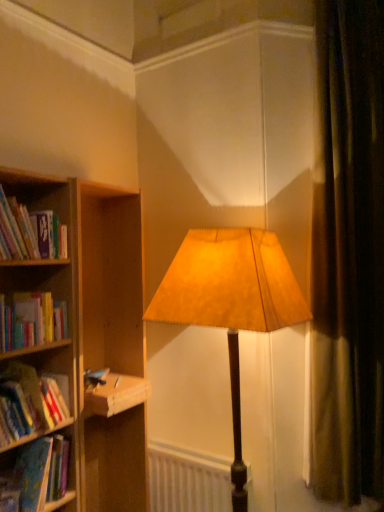
Image resolution: width=384 pixels, height=512 pixels. What do you see at coordinates (231, 303) in the screenshot? I see `suede-like beige lampshade at center` at bounding box center [231, 303].

In order to face hardcover book at left, the 4th book from the bottom, should I rotate leftwards or rightwards?

A 22.271 degree turn to the left will do.

The width and height of the screenshot is (384, 512). What do you see at coordinates (115, 395) in the screenshot? I see `hardcover book at left` at bounding box center [115, 395].

The image size is (384, 512). What do you see at coordinates (31, 321) in the screenshot? I see `hardcover book at left, which is the 2th book from top to bottom` at bounding box center [31, 321].

Measure the distance between hardcover book at left, the 1th book positioned from the bottom, and camera.

A distance of 4.94 feet exists between hardcover book at left, the 1th book positioned from the bottom, and camera.

Identify the location of suede-like beige lampshade at center. Image resolution: width=384 pixels, height=512 pixels. (231, 303).

Based on the photo, which is more to the right, suede-like beige lampshade at center or hardcover book at left, arranged as the fourth book when viewed from the top?

suede-like beige lampshade at center.

Is hardcover book at left, the 1th book positioned from the bottom, at the back of suede-like beige lampshade at center?

No, suede-like beige lampshade at center's orientation is not away from hardcover book at left, the 1th book positioned from the bottom.

This screenshot has height=512, width=384. Find the location of `lamp above the hardcover book at left, arranged as the fourth book when viewed from the top (from a real-world perspective)`. lamp above the hardcover book at left, arranged as the fourth book when viewed from the top (from a real-world perspective) is located at coordinates (231, 303).

Is suede-like beige lampshade at center in front of or behind hardcover book at left, the 1th book positioned from the bottom, in the image?

suede-like beige lampshade at center is behind hardcover book at left, the 1th book positioned from the bottom.

In the scene shown: In the image, is suede-like beige lampshade at center positioned in front of or behind hardcover book at left, which ranks as the 1th book in top-to-bottom order?

Visually, suede-like beige lampshade at center is located behind hardcover book at left, which ranks as the 1th book in top-to-bottom order.

From the picture: From the image's perspective, is suede-like beige lampshade at center under hardcover book at left, the 4th book from the bottom?

Yes.

Between suede-like beige lampshade at center and hardcover book at left, the 4th book from the bottom, which one appears on the left side from the viewer's perspective?

hardcover book at left, the 4th book from the bottom.

Considering the sizes of suede-like beige lampshade at center and hardcover book at left, the 4th book from the bottom, in the image, is suede-like beige lampshade at center taller or shorter than hardcover book at left, the 4th book from the bottom,?

suede-like beige lampshade at center is taller than hardcover book at left, the 4th book from the bottom.

Which object is closer to the camera taking this photo, brown velvet curtain at right or hardcover book at left, the 4th book from the bottom?

hardcover book at left, the 4th book from the bottom, is in front.

Is brown velvet curtain at right not within hardcover book at left, which ranks as the 1th book in top-to-bottom order?

Yes, brown velvet curtain at right is outside of hardcover book at left, which ranks as the 1th book in top-to-bottom order.

Which object is positioned more to the right, brown velvet curtain at right or hardcover book at left, which ranks as the 1th book in top-to-bottom order?

From the viewer's perspective, brown velvet curtain at right appears more on the right side.

Is the surface of hardcover book at left, arranged as the fourth book when viewed from the top, in direct contact with white matte radiator at lower center?

No, hardcover book at left, arranged as the fourth book when viewed from the top, is not beside white matte radiator at lower center.

Identify the location of the 1st book counting from the left of the white matte radiator at lower center. The width and height of the screenshot is (384, 512). (37, 475).

Could you measure the distance between hardcover book at left, the 1th book positioned from the bottom, and white matte radiator at lower center?

hardcover book at left, the 1th book positioned from the bottom, is 30.59 inches away from white matte radiator at lower center.

Who is shorter, hardcover book at left, arranged as the fourth book when viewed from the top, or white matte radiator at lower center?

hardcover book at left, arranged as the fourth book when viewed from the top, is shorter.

From the image's perspective, is hardcover book at left, which is the 2th book from top to bottom, above or below white matte radiator at lower center?

hardcover book at left, which is the 2th book from top to bottom, is above white matte radiator at lower center.

Who is taller, hardcover book at left, which is the 2th book from top to bottom, or white matte radiator at lower center?

white matte radiator at lower center.

Considering the sizes of hardcover book at left, the 3th book positioned from the bottom, and white matte radiator at lower center in the image, is hardcover book at left, the 3th book positioned from the bottom, bigger or smaller than white matte radiator at lower center?

hardcover book at left, the 3th book positioned from the bottom, is smaller than white matte radiator at lower center.

Is brown velvet curtain at right inside or outside of white matte radiator at lower center?

brown velvet curtain at right is located beyond the bounds of white matte radiator at lower center.

How distant is brown velvet curtain at right from white matte radiator at lower center?

They are 32.74 inches apart.

Which of these two, brown velvet curtain at right or white matte radiator at lower center, is wider?

brown velvet curtain at right is wider.

From a real-world perspective, relative to white matte radiator at lower center, is brown velvet curtain at right vertically above or below?

brown velvet curtain at right is above white matte radiator at lower center.

In terms of size, does hardcover book at left, which is the 2th book from top to bottom, appear bigger or smaller than suede-like beige lampshade at center?

Clearly, hardcover book at left, which is the 2th book from top to bottom, is smaller in size than suede-like beige lampshade at center.

There is a suede-like beige lampshade at center. Where is `the 2nd book above it (from a real-world perspective)`? the 2nd book above it (from a real-world perspective) is located at coordinates click(31, 321).

Can you confirm if hardcover book at left, which is the 2th book from top to bottom, is thinner than suede-like beige lampshade at center?

Yes, hardcover book at left, which is the 2th book from top to bottom, is thinner than suede-like beige lampshade at center.

Looking at this image, from a real-world perspective, is hardcover book at left, which is the 2th book from top to bottom, beneath suede-like beige lampshade at center?

No.

Locate an element on the screen. The height and width of the screenshot is (512, 384). lamp above the hardcover book at left, the 1th book positioned from the bottom (from the image's perspective) is located at coordinates (231, 303).

This screenshot has height=512, width=384. Find the location of `the 1st book in front of the suede-like beige lampshade at center, counting from the anchor's position`. the 1st book in front of the suede-like beige lampshade at center, counting from the anchor's position is located at coordinates (29, 232).

From the image, which object appears to be nearer to hardcover book at left, the 1th book positioned from the bottom, hardcover book at left, acting as the 2th book starting from the bottom, or hardcover book at left, which ranks as the 1th book in top-to-bottom order?

hardcover book at left, acting as the 2th book starting from the bottom, lies closer to hardcover book at left, the 1th book positioned from the bottom, than the other object.

When comparing their distances from hardcover book at left, the 1th book positioned from the bottom, does hardcover book at left, the 4th book from the bottom, or suede-like beige lampshade at center seem closer?

hardcover book at left, the 4th book from the bottom, lies closer to hardcover book at left, the 1th book positioned from the bottom, than the other object.

When comparing their distances from hardcover book at left, acting as the 2th book starting from the bottom, does white matte radiator at lower center or brown velvet curtain at right seem further?

Based on the image, brown velvet curtain at right appears to be further to hardcover book at left, acting as the 2th book starting from the bottom.

From the image, which object appears to be nearer to hardcover book at left, suede-like beige lampshade at center or hardcover book at left, the 3th book positioned from the bottom?

Among the two, hardcover book at left, the 3th book positioned from the bottom, is located nearer to hardcover book at left.

Consider the image. Looking at the image, which one is located further to hardcover book at left, which ranks as the 1th book in top-to-bottom order, hardcover book at left, which is the 2th book from top to bottom, or hardcover book at left, arranged as the fourth book when viewed from the top?

hardcover book at left, arranged as the fourth book when viewed from the top, is further to hardcover book at left, which ranks as the 1th book in top-to-bottom order.

Which object lies nearer to the anchor point brown velvet curtain at right, suede-like beige lampshade at center or hardcover book at left, the 3th book positioned from the bottom?

suede-like beige lampshade at center is positioned closer to the anchor brown velvet curtain at right.

From the image, which object appears to be farther from brown velvet curtain at right, hardcover book at left or suede-like beige lampshade at center?

hardcover book at left.

From the picture: Looking at the image, which one is located further to hardcover book at left, hardcover book at left, which is the 2th book from top to bottom, or hardcover book at left, acting as the 2th book starting from the bottom?

Among the two, hardcover book at left, which is the 2th book from top to bottom, is located further to hardcover book at left.

Where is `lamp located between hardcover book at left, arranged as the fourth book when viewed from the top, and brown velvet curtain at right in the left-right direction`? The height and width of the screenshot is (512, 384). lamp located between hardcover book at left, arranged as the fourth book when viewed from the top, and brown velvet curtain at right in the left-right direction is located at coordinates (231, 303).

Where is `paperback book located between hardcover book at left, which is the 2th book from top to bottom, and brown velvet curtain at right in the left-right direction`? The height and width of the screenshot is (512, 384). paperback book located between hardcover book at left, which is the 2th book from top to bottom, and brown velvet curtain at right in the left-right direction is located at coordinates (115, 395).

Identify the location of lamp situated between hardcover book at left, the 3th book positioned from the bottom, and brown velvet curtain at right from left to right. This screenshot has height=512, width=384. (231, 303).

Identify the location of paperback book located between hardcover book at left, the 1th book positioned from the bottom, and brown velvet curtain at right in the left-right direction. This screenshot has width=384, height=512. (115, 395).